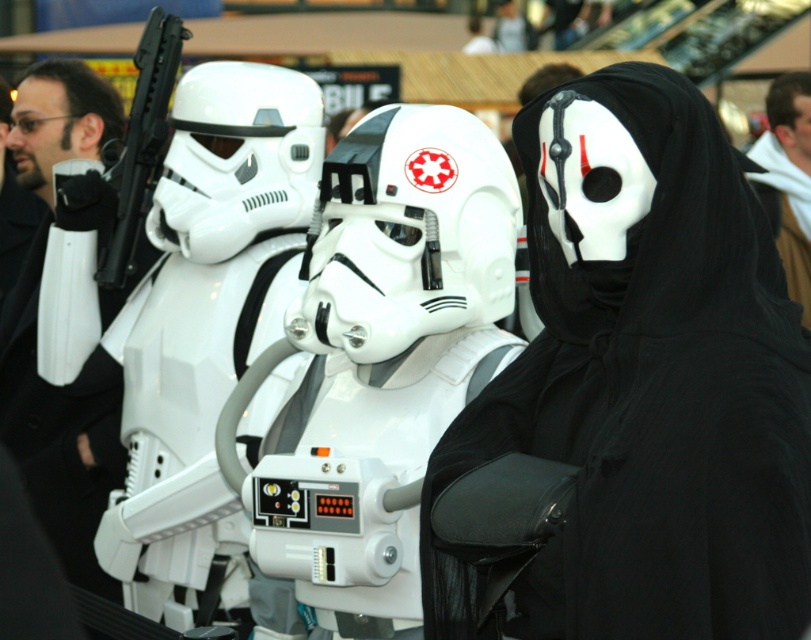
Question: From the image, what is the correct spatial relationship of black matte mask at center in relation to black fabric scarf at upper right?

Choices:
 (A) left
 (B) right

Answer: (A)

Question: Considering the relative positions of matte black coat at left and black fabric scarf at upper right in the image provided, where is matte black coat at left located with respect to black fabric scarf at upper right?

Choices:
 (A) left
 (B) right

Answer: (A)

Question: Which object is the farthest from the black matte mask at center?

Choices:
 (A) black fabric scarf at upper right
 (B) matte black coat at left

Answer: (A)

Question: Which point is farther to the camera?

Choices:
 (A) (114, 211)
 (B) (564, 570)
 (C) (779, 205)

Answer: (C)

Question: Is black matte mask at center closer to the viewer compared to black fabric scarf at upper right?

Choices:
 (A) yes
 (B) no

Answer: (A)

Question: Estimate the real-world distances between objects in this image. Which object is closer to the black matte mask at center?

Choices:
 (A) matte black coat at left
 (B) black fabric scarf at upper right

Answer: (A)